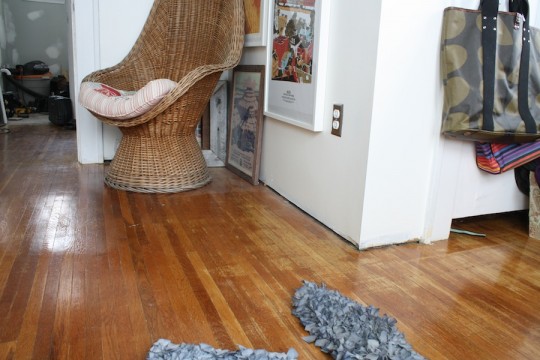
This screenshot has width=540, height=360. Identify the location of white splotches on wall. (55, 55), (54, 68), (33, 12), (5, 25), (3, 37), (18, 59).